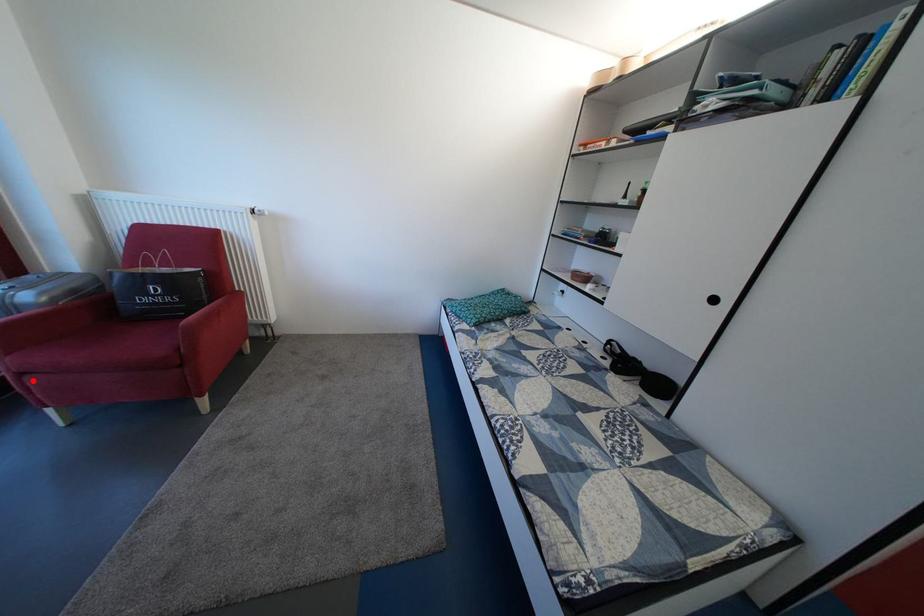
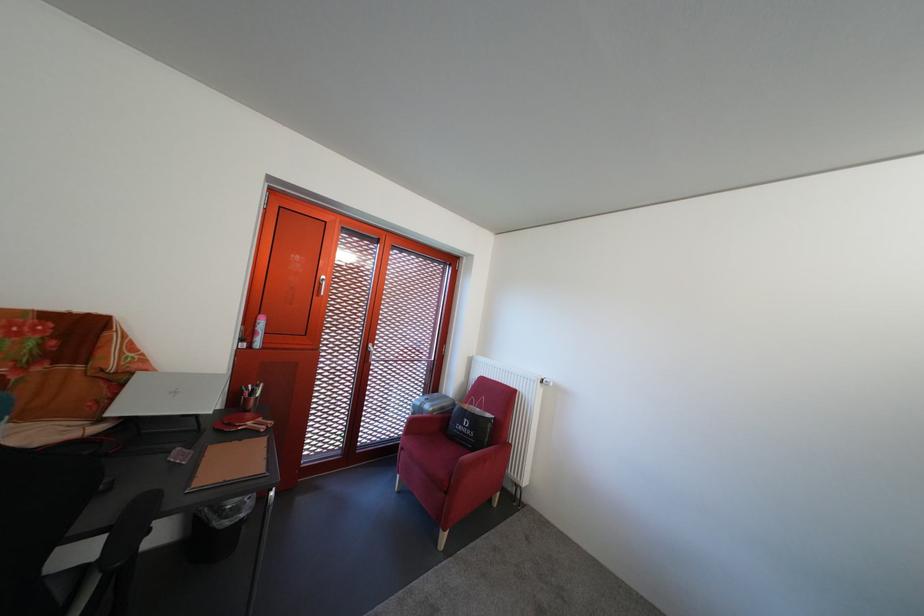
Question: I am providing you with two images of the same scene from different viewpoints. A red point is shown in image1. For the corresponding object point in image2, is it positioned nearer or farther from the camera?

Choices:
 (A) Nearer
 (B) Farther

Answer: (B)